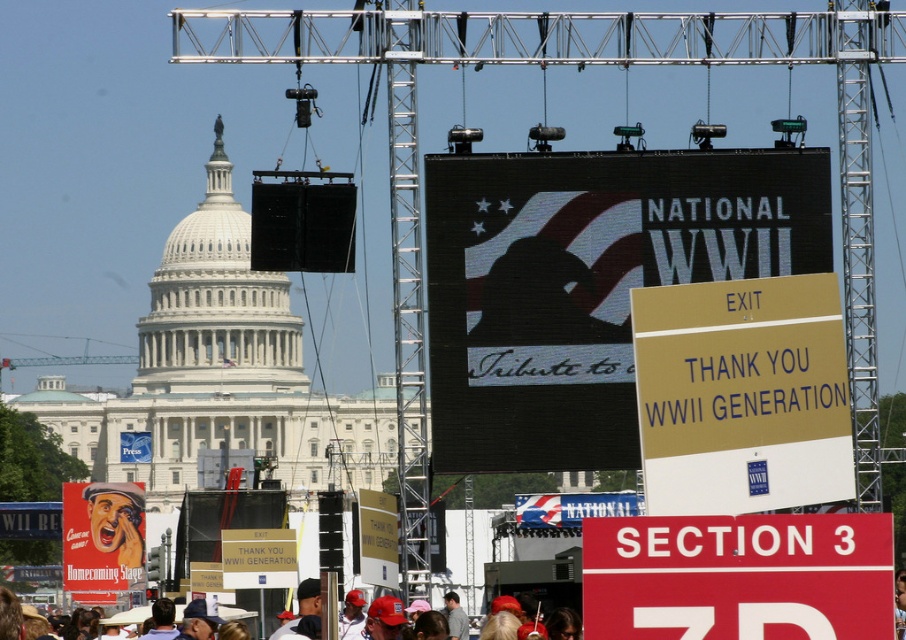
Question: Which point appears closest to the camera in this image?

Choices:
 (A) (358, 611)
 (B) (463, 630)

Answer: (A)

Question: Does red plastic sign at lower right appear on the right side of red fabric hats at lower center?

Choices:
 (A) no
 (B) yes

Answer: (B)

Question: Does red plastic sign at lower right have a lesser width compared to denim jacket at lower center?

Choices:
 (A) yes
 (B) no

Answer: (B)

Question: Among these objects, which one is nearest to the camera?

Choices:
 (A) black matte scoreboard at upper center
 (B) red fabric hats at lower center
 (C) metallic helmet at center
 (D) denim jacket at lower center

Answer: (A)

Question: Which is farther from the red plastic sign at lower right?

Choices:
 (A) dark blue baseball cap at center
 (B) black matte scoreboard at upper center
 (C) metallic helmet at center
 (D) red fabric hats at lower center

Answer: (D)

Question: Can you confirm if dark blue baseball cap at center is thinner than red fabric hats at lower center?

Choices:
 (A) no
 (B) yes

Answer: (B)